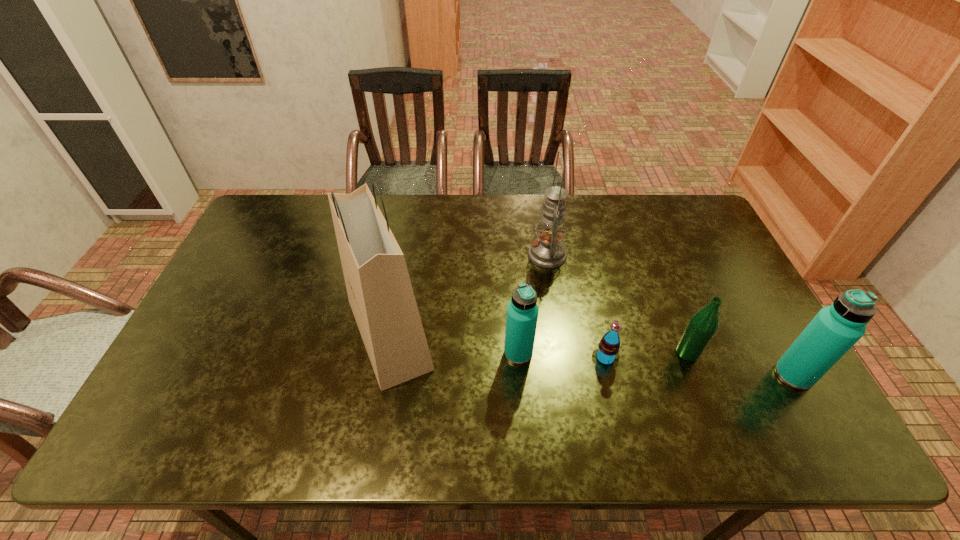
Considering the uniform spacing of water bottles, where should an additional water bottle be positioned on the left? Please locate a free spot. Please provide its 2D coordinates. Your answer should be formatted as a tuple, i.e. [(x, y)], where the tuple contains the x and y coordinates of a point satisfying the conditions above.

[(264, 333)]